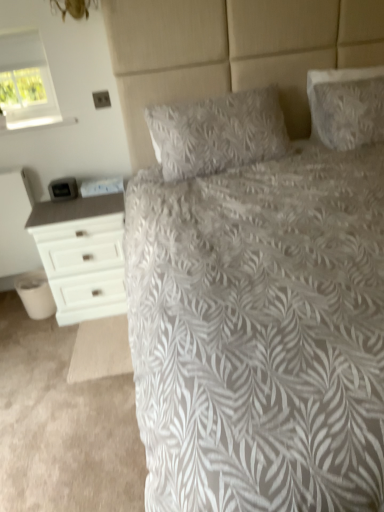
Question: Can you confirm if white fabric window at upper left is positioned to the left of white textured bed at center?

Choices:
 (A) yes
 (B) no

Answer: (A)

Question: Considering the relative sizes of white fabric window at upper left and white textured bed at center in the image provided, is white fabric window at upper left bigger than white textured bed at center?

Choices:
 (A) yes
 (B) no

Answer: (B)

Question: Can you confirm if white fabric window at upper left is thinner than white textured bed at center?

Choices:
 (A) no
 (B) yes

Answer: (B)

Question: Does white fabric window at upper left have a smaller size compared to white textured bed at center?

Choices:
 (A) yes
 (B) no

Answer: (A)

Question: Does white fabric window at upper left appear on the right side of white textured bed at center?

Choices:
 (A) no
 (B) yes

Answer: (A)

Question: Does white fabric window at upper left have a greater height compared to white textured bed at center?

Choices:
 (A) yes
 (B) no

Answer: (B)

Question: Can you confirm if white textured bed at center is bigger than white fabric window at upper left?

Choices:
 (A) yes
 (B) no

Answer: (A)

Question: Is white textured bed at center not within white fabric window at upper left?

Choices:
 (A) yes
 (B) no

Answer: (A)

Question: Can you confirm if white textured bed at center is thinner than white fabric window at upper left?

Choices:
 (A) no
 (B) yes

Answer: (A)

Question: Is white textured bed at center at the left side of white fabric window at upper left?

Choices:
 (A) yes
 (B) no

Answer: (B)

Question: Is white textured bed at center wider than white fabric window at upper left?

Choices:
 (A) yes
 (B) no

Answer: (A)

Question: From the image's perspective, does white textured bed at center appear lower than white fabric window at upper left?

Choices:
 (A) yes
 (B) no

Answer: (A)

Question: Is white fabric window at upper left wider than white textured pillow at upper right, which ranks as the first pillow in right-to-left order?

Choices:
 (A) no
 (B) yes

Answer: (B)